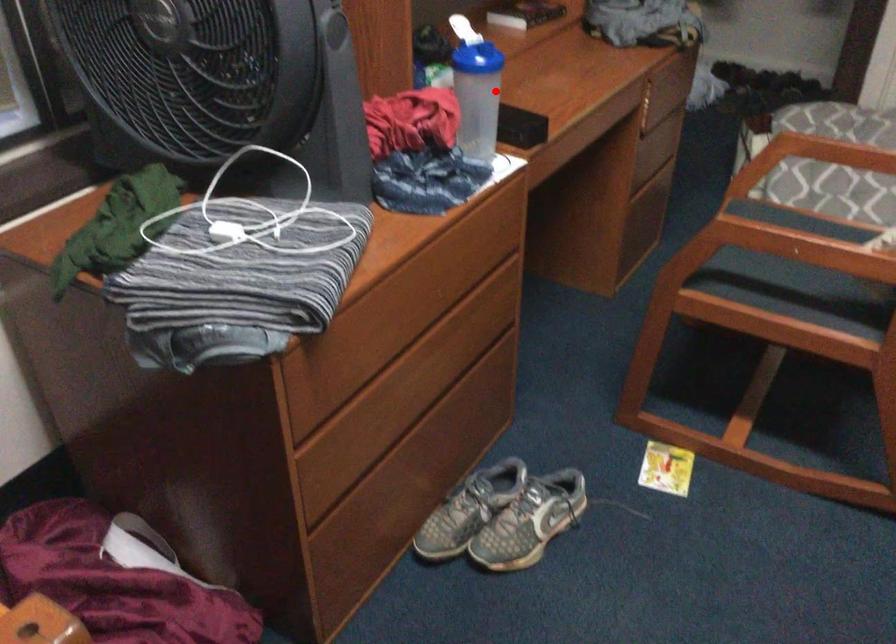
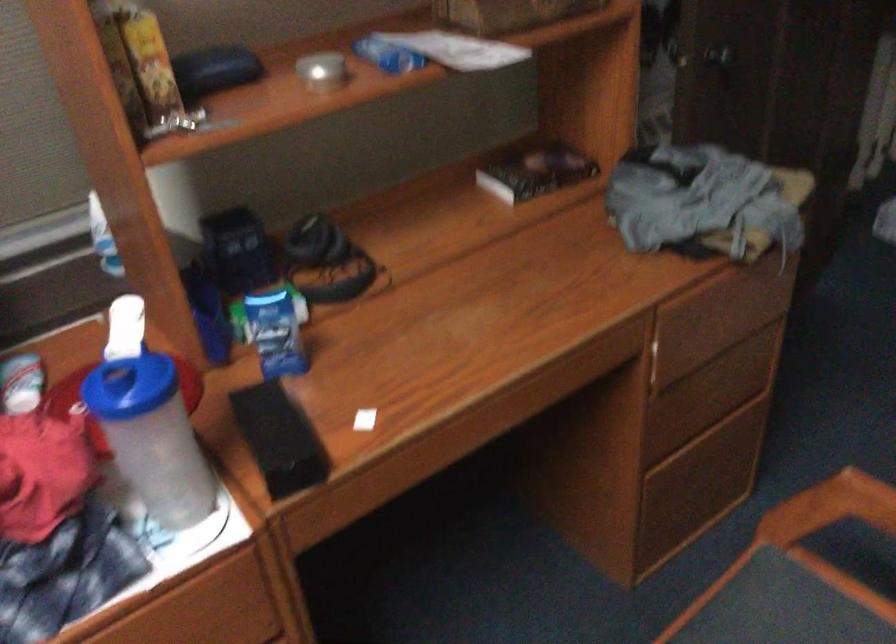
The point at the highlighted location is marked in the first image. Where is the corresponding point in the second image?

(151, 437)